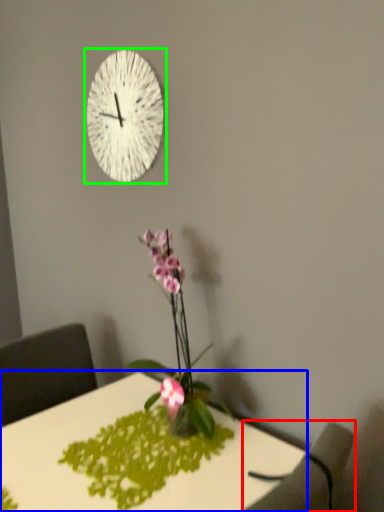
Question: Which is farther away from armchair (highlighted by a red box)? desk (highlighted by a blue box) or wall clock (highlighted by a green box)?

Choices:
 (A) desk
 (B) wall clock

Answer: (B)